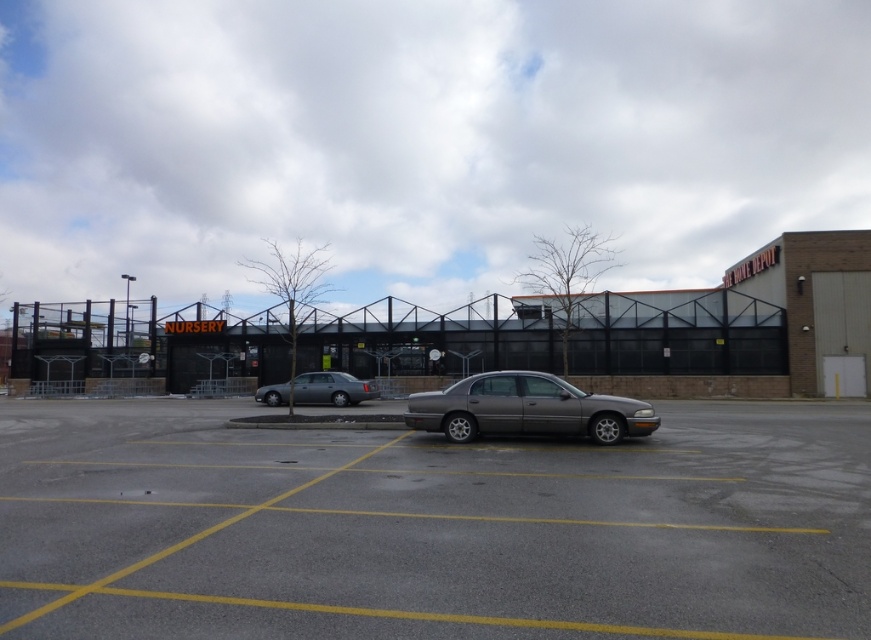
Based on the photo, which is more to the left, satin gray sedan at center or satin silver sedan at center?

Positioned to the left is satin silver sedan at center.

Measure the distance between point (437, 426) and camera.

Point (437, 426) and camera are 14.35 meters apart.

This screenshot has width=871, height=640. I want to click on satin gray sedan at center, so click(x=525, y=410).

Does point (366, 465) come behind point (565, 420)?

No, (366, 465) is in front of (565, 420).

Between gray asphalt parking lot at center and satin gray sedan at center, which one is positioned lower?

gray asphalt parking lot at center is lower down.

Find the location of `gray asphalt parking lot at center`. gray asphalt parking lot at center is located at coordinates (431, 525).

The width and height of the screenshot is (871, 640). What are the coordinates of `gray asphalt parking lot at center` in the screenshot? It's located at (431, 525).

Which is in front, point (45, 589) or point (304, 372)?

Positioned in front is point (45, 589).

Between point (278, 572) and point (327, 397), which one is positioned behind?

Point (327, 397)

Is point (571, 529) positioned before point (356, 378)?

Yes, point (571, 529) is closer to viewer.

This screenshot has width=871, height=640. I want to click on gray asphalt parking lot at center, so click(431, 525).